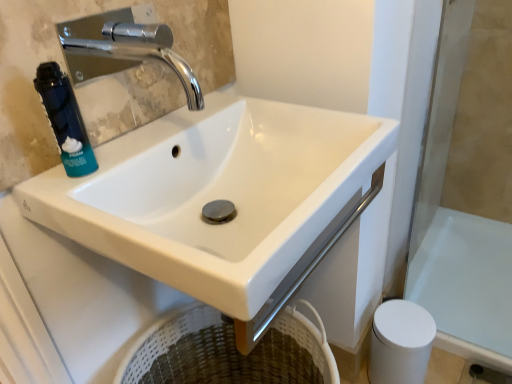
Question: From the image's perspective, does white glossy sink at center appear lower than white matte toilet paper at lower right?

Choices:
 (A) yes
 (B) no

Answer: (B)

Question: Can you see white glossy sink at center touching white matte toilet paper at lower right?

Choices:
 (A) yes
 (B) no

Answer: (B)

Question: Can you confirm if white glossy sink at center is shorter than white matte toilet paper at lower right?

Choices:
 (A) no
 (B) yes

Answer: (A)

Question: From the image's perspective, is white glossy sink at center above white matte toilet paper at lower right?

Choices:
 (A) no
 (B) yes

Answer: (B)

Question: Is white glossy sink at center thinner than white matte toilet paper at lower right?

Choices:
 (A) yes
 (B) no

Answer: (B)

Question: Can you confirm if white glossy sink at center is smaller than white matte toilet paper at lower right?

Choices:
 (A) yes
 (B) no

Answer: (B)

Question: Does chrome metallic faucet at upper left have a larger size compared to white glossy sink at center?

Choices:
 (A) yes
 (B) no

Answer: (B)

Question: Is chrome metallic faucet at upper left closer to the viewer compared to white glossy sink at center?

Choices:
 (A) no
 (B) yes

Answer: (A)

Question: Is there a large distance between chrome metallic faucet at upper left and white glossy sink at center?

Choices:
 (A) yes
 (B) no

Answer: (B)

Question: Can you confirm if chrome metallic faucet at upper left is taller than white glossy sink at center?

Choices:
 (A) yes
 (B) no

Answer: (B)

Question: Does chrome metallic faucet at upper left turn towards white glossy sink at center?

Choices:
 (A) yes
 (B) no

Answer: (B)

Question: From a real-world perspective, is chrome metallic faucet at upper left located beneath white glossy sink at center?

Choices:
 (A) no
 (B) yes

Answer: (A)

Question: Is white glossy sink at center surrounded by white glossy bath at lower right?

Choices:
 (A) no
 (B) yes

Answer: (A)